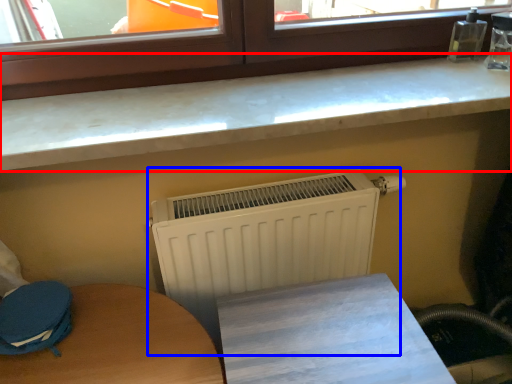
Question: Which object appears farthest to the camera in this image, countertop (highlighted by a red box) or radiator (highlighted by a blue box)?

Choices:
 (A) countertop
 (B) radiator

Answer: (B)